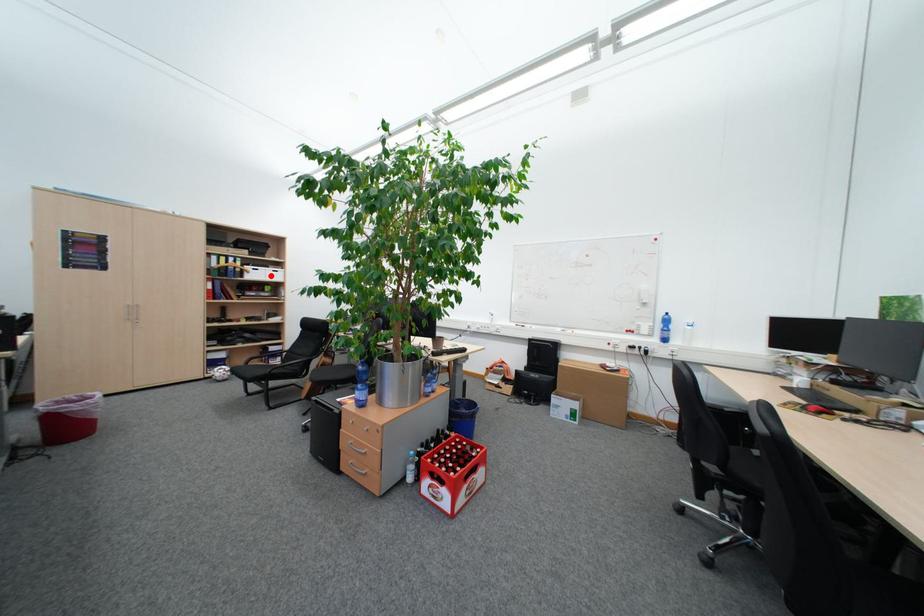
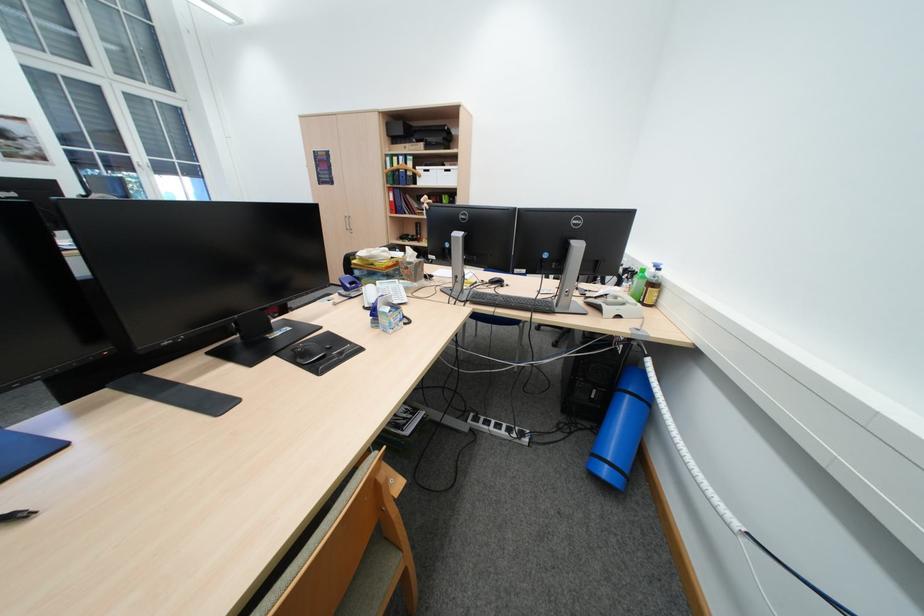
In the second image, find the point that corresponds to the highlighted location in the first image.

(442, 179)